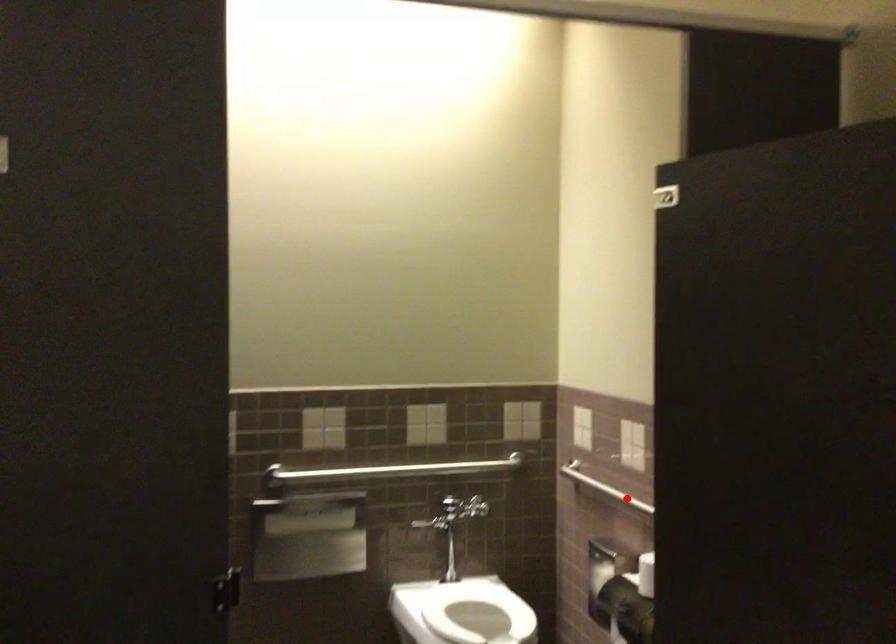
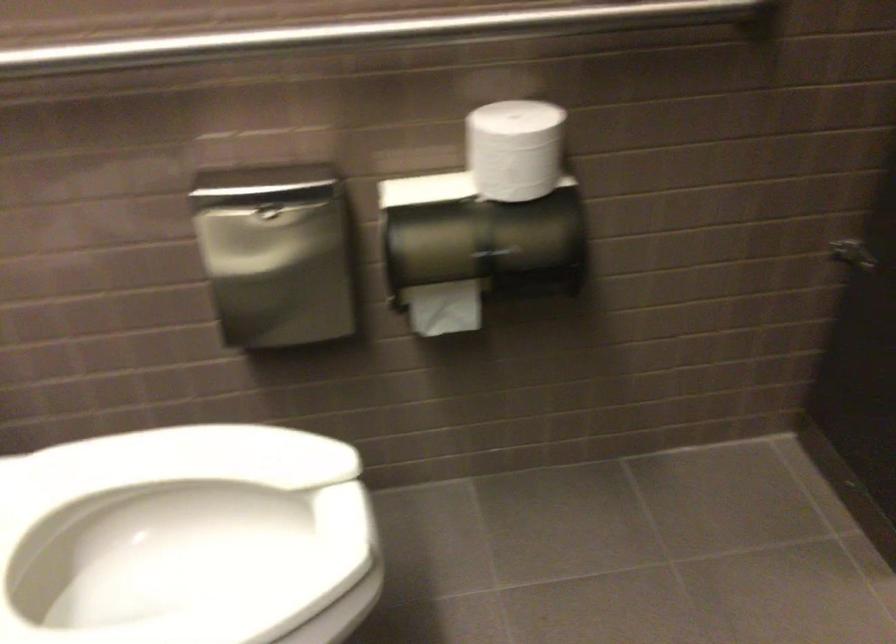
The point at the highlighted location is marked in the first image. Where is the corresponding point in the second image?

(368, 33)